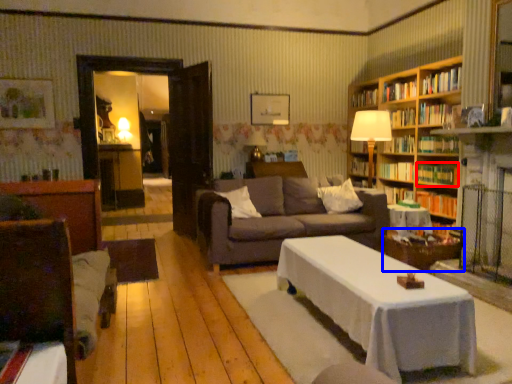
Question: Which of the following is the farthest to the observer, book (highlighted by a red box) or side table (highlighted by a blue box)?

Choices:
 (A) book
 (B) side table

Answer: (A)